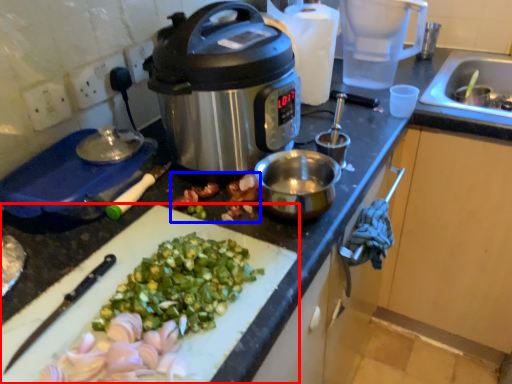
Question: Among these objects, which one is farthest to the camera, cutting board (highlighted by a red box) or produce (highlighted by a blue box)?

Choices:
 (A) cutting board
 (B) produce

Answer: (B)